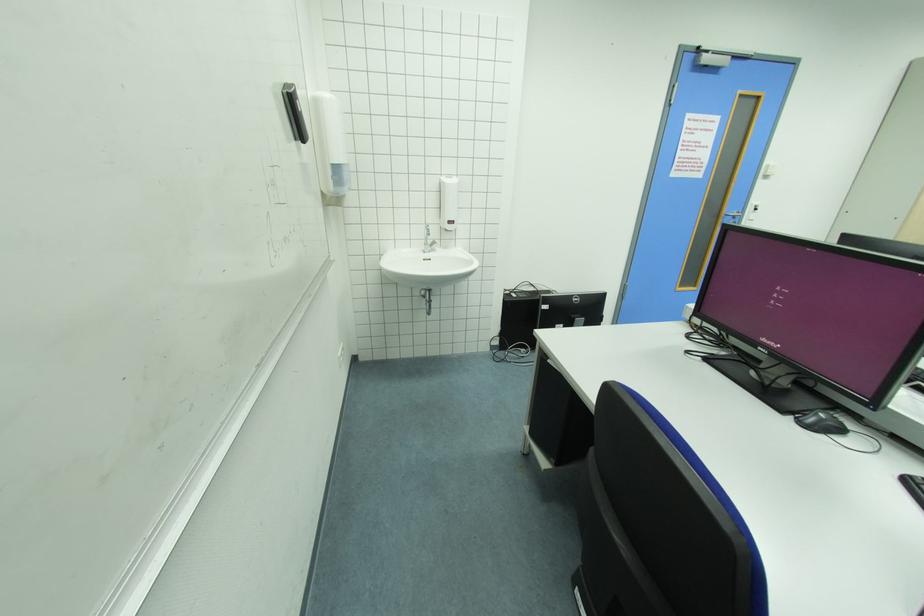
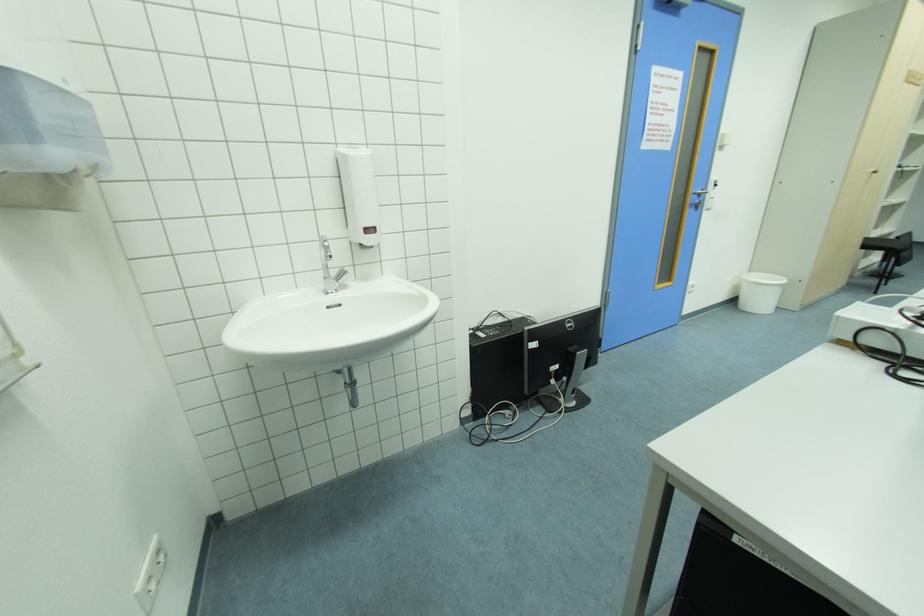
Question: The images are taken continuously from a first-person perspective. In which direction are you moving?

Choices:
 (A) Left
 (B) Right
 (C) Forward
 (D) Backward

Answer: (C)